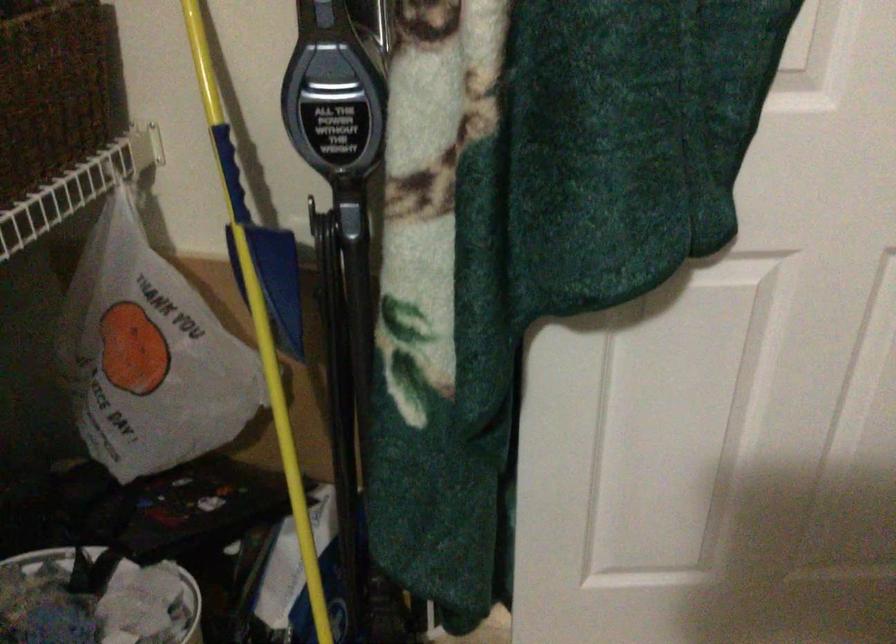
This screenshot has width=896, height=644. What do you see at coordinates (332, 93) in the screenshot?
I see `a vacuum cleaner handle` at bounding box center [332, 93].